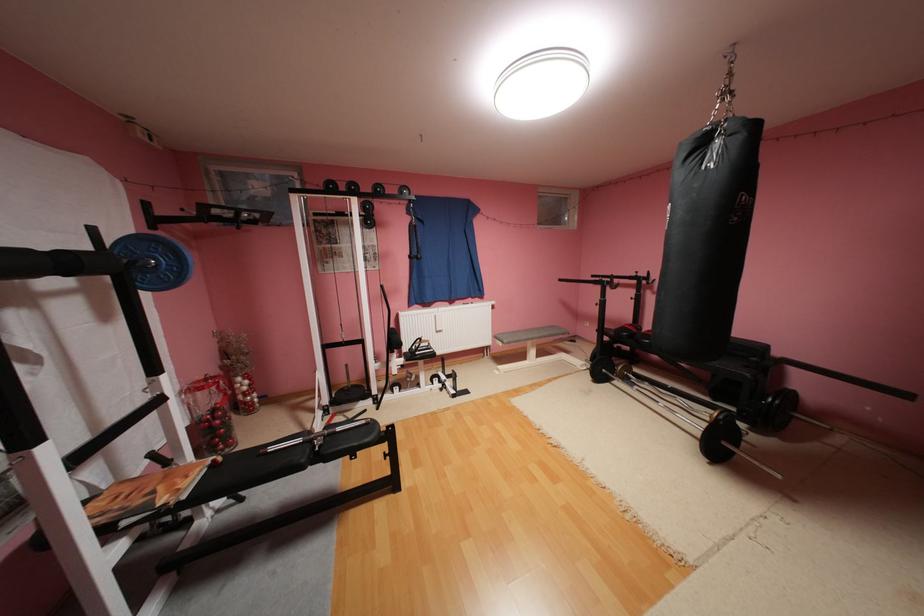
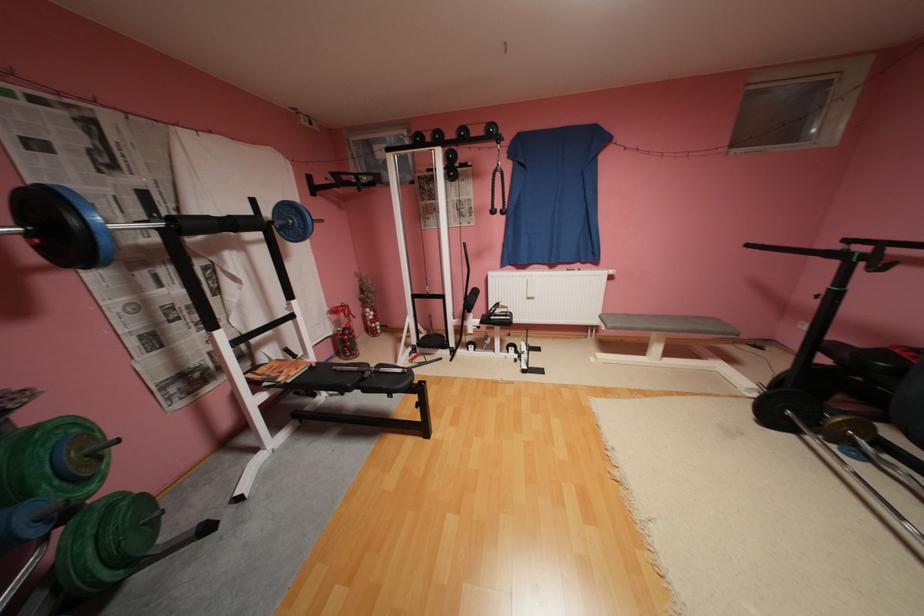
Where in the second image is the point corresponding to the point at 569,280 from the first image?

(757, 246)